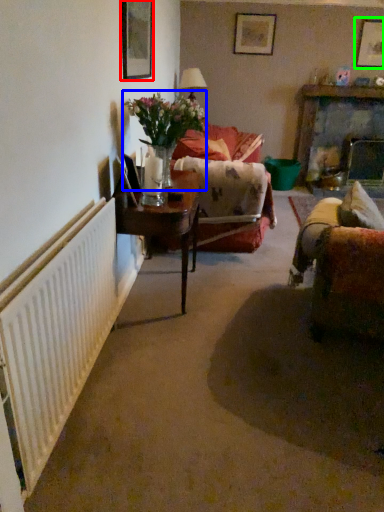
Question: Which is nearer to the picture frame (highlighted by a red box)? floral arrangement (highlighted by a blue box) or picture frame (highlighted by a green box).

Choices:
 (A) floral arrangement
 (B) picture frame

Answer: (A)